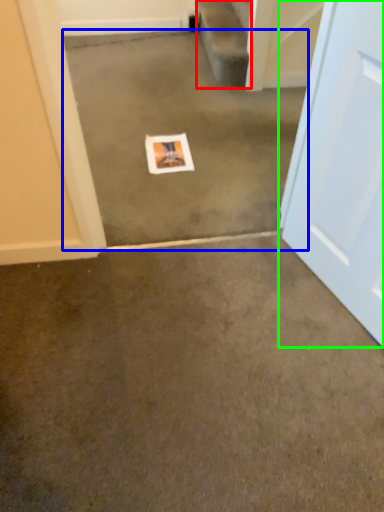
Question: Estimate the real-world distances between objects in this image. Which object is farther from stairwell (highlighted by a red box), concrete (highlighted by a blue box) or door (highlighted by a green box)?

Choices:
 (A) concrete
 (B) door

Answer: (B)